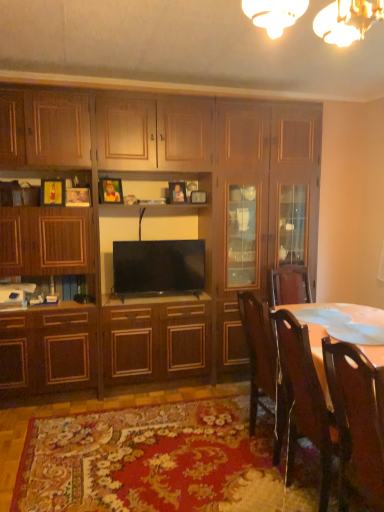
Question: Considering their positions, is wooden chair at right, which appears as the second chair when viewed from the back, located in front of or behind flat screen tv at center?

Choices:
 (A) front
 (B) behind

Answer: (A)

Question: Considering the positions of wooden chair at right, which is the first chair in front-to-back order, and flat screen tv at center in the image, is wooden chair at right, which is the first chair in front-to-back order, wider or thinner than flat screen tv at center?

Choices:
 (A) thin
 (B) wide

Answer: (B)

Question: Considering the real-world distances, which object is farthest from the wooden cabinet at center?

Choices:
 (A) wooden chair at right, which appears as the second chair when viewed from the back
 (B) flat screen tv at center
 (C) wooden chair at lower right, the second chair when ordered from front to back
 (D) gold metallic chandelier at upper center

Answer: (A)

Question: Estimate the real-world distances between objects in this image. Which object is farther from the wooden cabinet at center?

Choices:
 (A) flat screen tv at center
 (B) wooden chair at lower right, the second chair when ordered from front to back
 (C) wooden chair at right, which appears as the second chair when viewed from the back
 (D) gold metallic chandelier at upper center

Answer: (C)